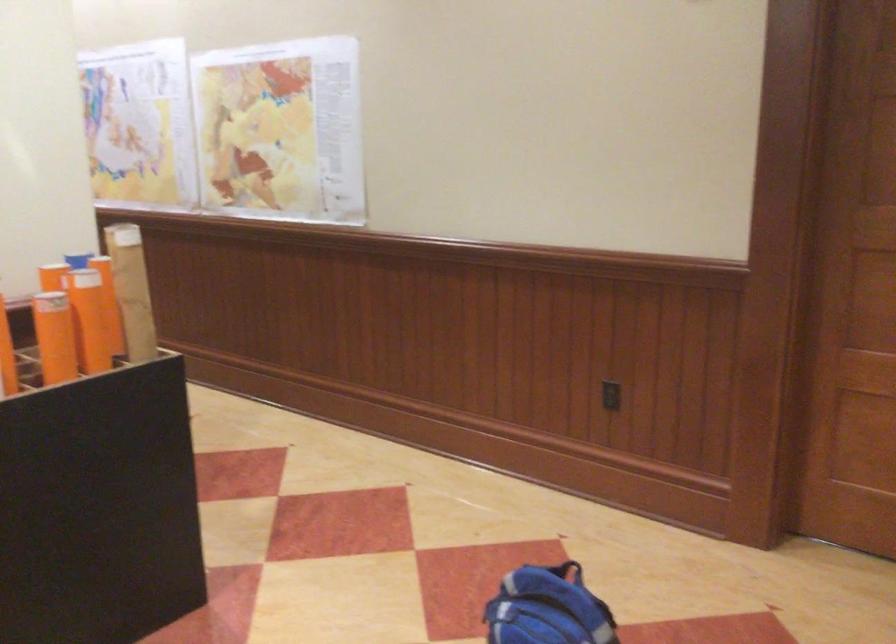
What do you see at coordinates (567, 571) in the screenshot? I see `a blue backpack handle` at bounding box center [567, 571].